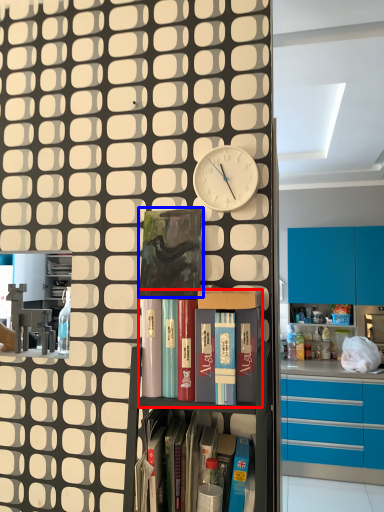
Question: Which of the following is the closest to the observer, shelf (highlighted by a red box) or paperback book (highlighted by a blue box)?

Choices:
 (A) shelf
 (B) paperback book

Answer: (A)